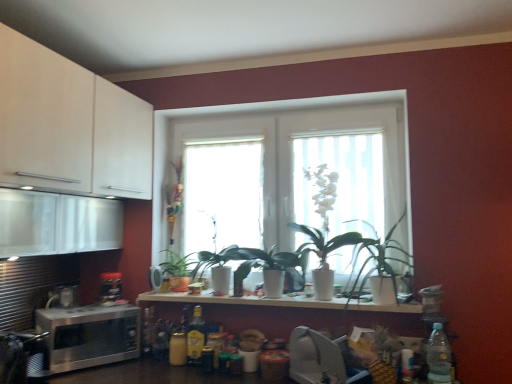
Where is `vacant area that is situated to the right of satin silver microwave at left, acting as the second appliance starting from the right`? The image size is (512, 384). vacant area that is situated to the right of satin silver microwave at left, acting as the second appliance starting from the right is located at coordinates (180, 294).